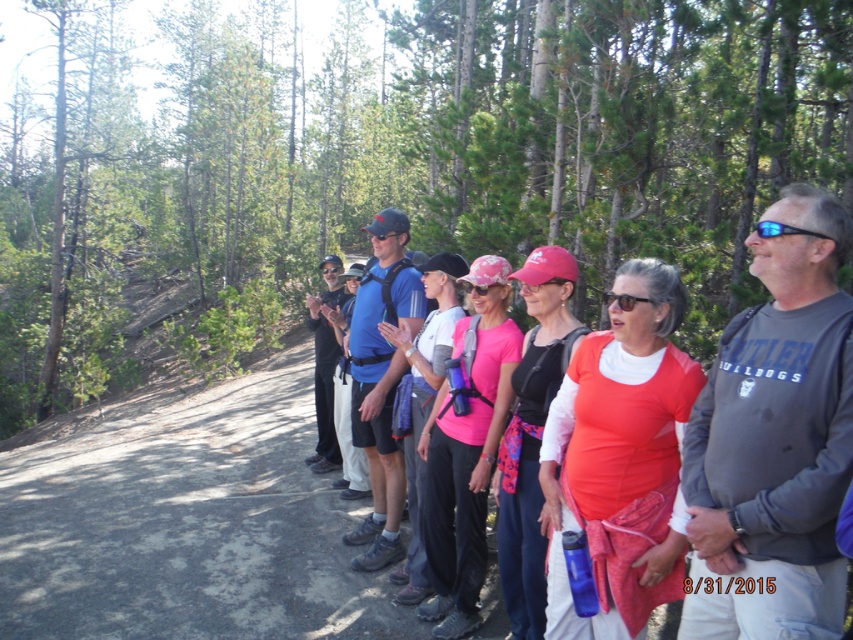
Question: Does gray cotton sweatshirt at right have a lesser width compared to matte orange shirt at center?

Choices:
 (A) no
 (B) yes

Answer: (B)

Question: Does gray cotton sweatshirt at right appear under matte orange shirt at center?

Choices:
 (A) yes
 (B) no

Answer: (B)

Question: Is green leafy trees at center to the right of matte orange shirt at center from the viewer's perspective?

Choices:
 (A) no
 (B) yes

Answer: (A)

Question: Based on their relative distances, which object is farther from the green leafy trees at center?

Choices:
 (A) gray cotton sweatshirt at right
 (B) matte orange shirt at center

Answer: (A)

Question: Which object is positioned closest to the gray cotton sweatshirt at right?

Choices:
 (A) matte orange shirt at center
 (B) green leafy trees at center

Answer: (A)

Question: Which point appears farthest from the camera in this image?

Choices:
 (A) (723, 579)
 (B) (608, 592)
 (C) (395, 20)

Answer: (C)